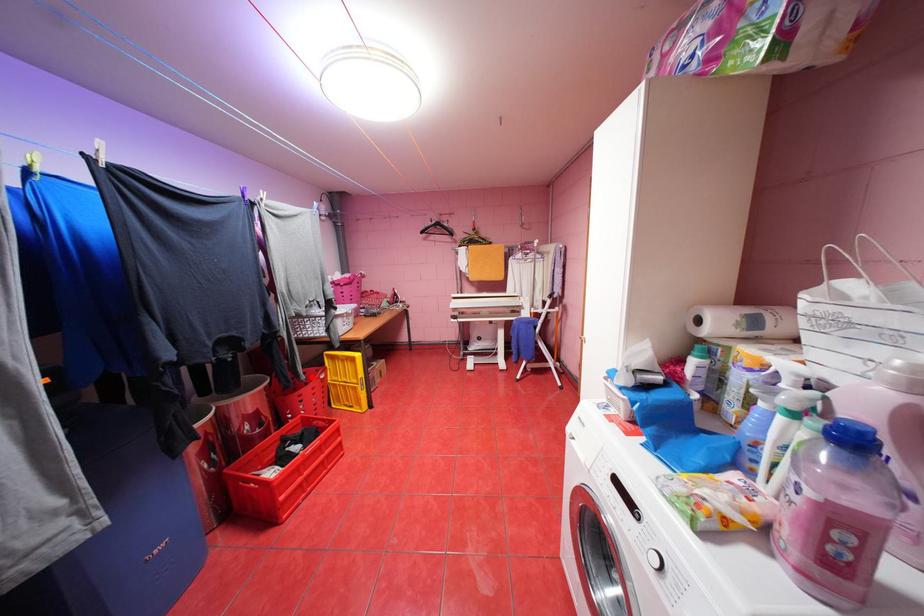
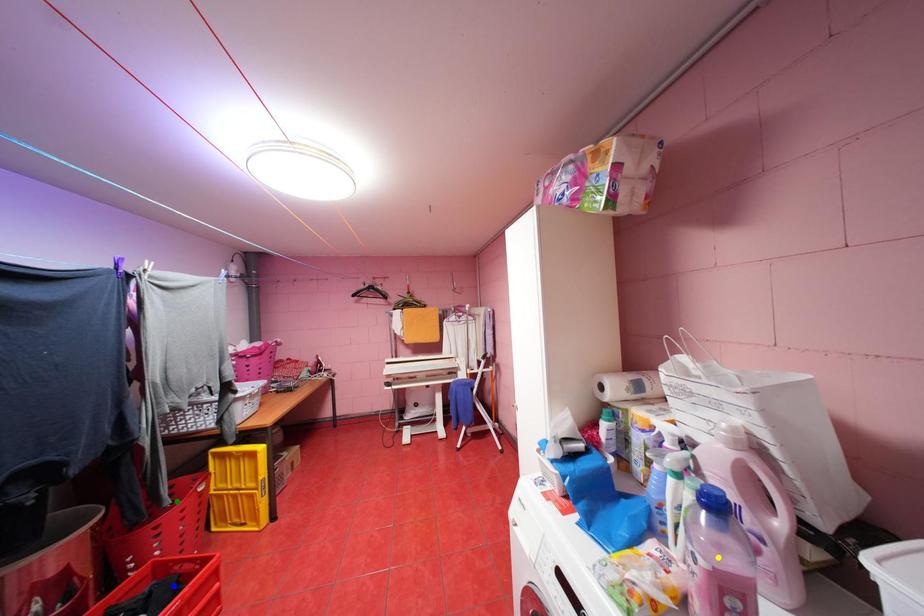
Question: I am providing you with two images of the same scene from different viewpoints. A red point is marked on the first image. You are given multiple points on the second image. Which point in image 2 represents the same 3d spot as the red point in image 1?

Choices:
 (A) blue point
 (B) yellow point
 (C) green point

Answer: (C)